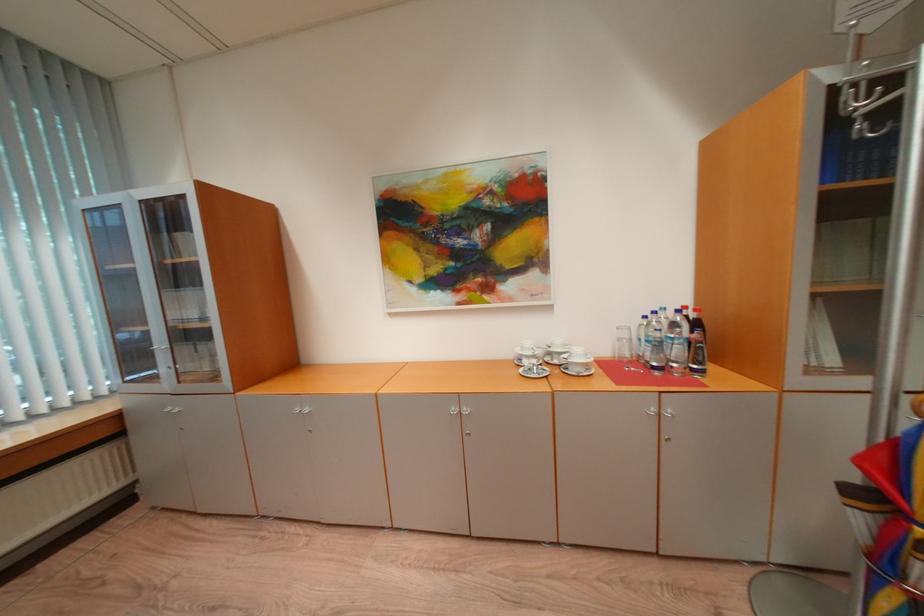
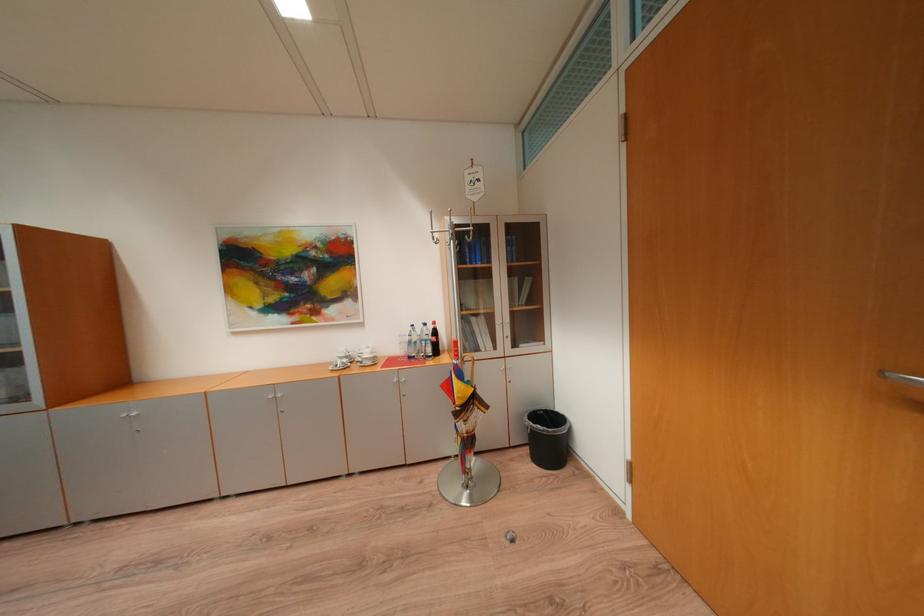
The point at (x=666, y=345) is marked in the first image. Where is the corresponding point in the second image?

(419, 344)